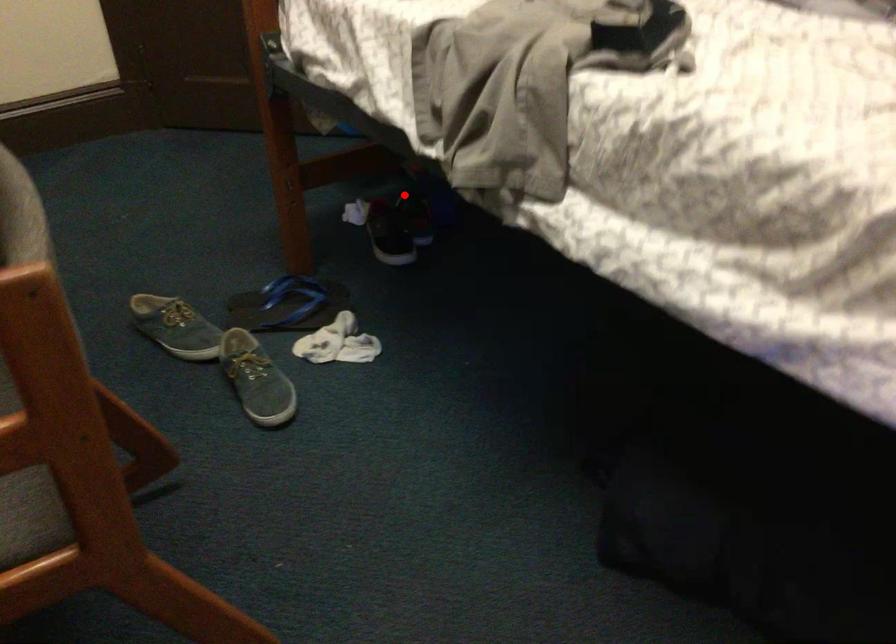
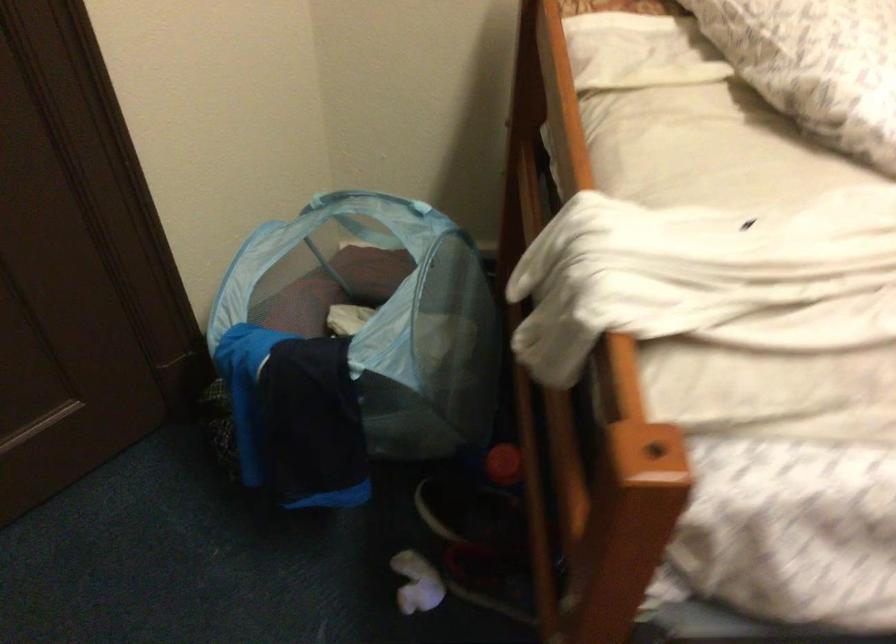
The point at the highlighted location is marked in the first image. Where is the corresponding point in the second image?

(469, 509)